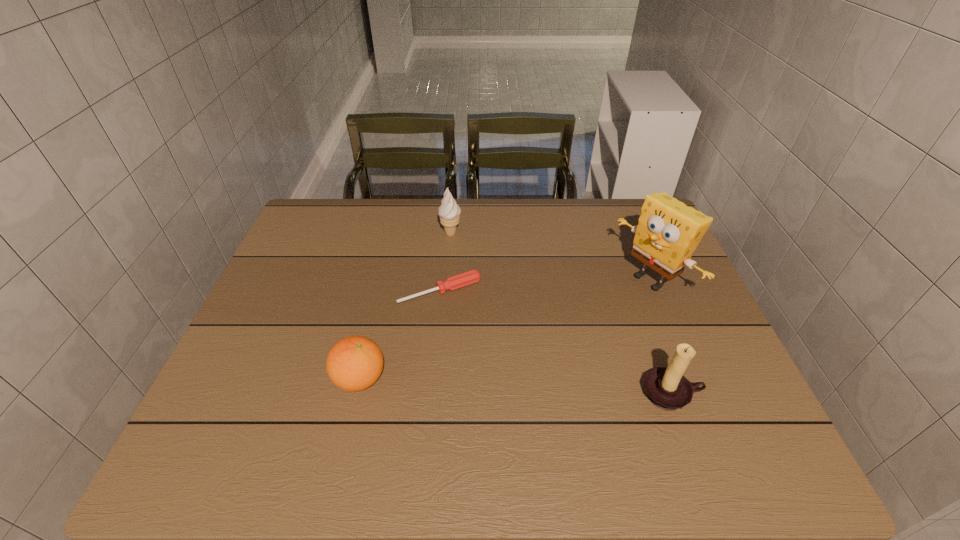
Where is `vacant area between the shortest object and the farthest object`? vacant area between the shortest object and the farthest object is located at coordinates (445, 262).

The width and height of the screenshot is (960, 540). I want to click on empty space between the sponge and the shortest object, so click(545, 286).

Locate an element on the screen. Image resolution: width=960 pixels, height=540 pixels. free space between the screwdriver and the farthest object is located at coordinates (445, 262).

Where is `vacant area that lies between the orange and the icecream`? vacant area that lies between the orange and the icecream is located at coordinates (405, 306).

Image resolution: width=960 pixels, height=540 pixels. I want to click on vacant area that lies between the tallest object and the fourth tallest object, so click(x=505, y=329).

Image resolution: width=960 pixels, height=540 pixels. I want to click on free space between the candle holder and the icecream, so click(561, 314).

This screenshot has height=540, width=960. Identify the location of object that ranks as the fourth closest to the screwdriver. (666, 387).

Locate an element on the screen. object that ranks as the third closest to the tallest object is located at coordinates (449, 211).

You are a GUI agent. You are given a task and a screenshot of the screen. Output one action in this format:
    pyautogui.click(x=<x>, y=<y>)
    Task: Click on the free space that satisfies the following two spatial constraints: 1. on the front side of the tallest object; 2. on the right side of the icecream
    This screenshot has height=540, width=960.
    Given the screenshot: What is the action you would take?
    pyautogui.click(x=447, y=280)

The height and width of the screenshot is (540, 960). Identify the location of vacant point that satisfies the following two spatial constraints: 1. on the back side of the shortest object; 2. on the right side of the farthest object. (445, 233).